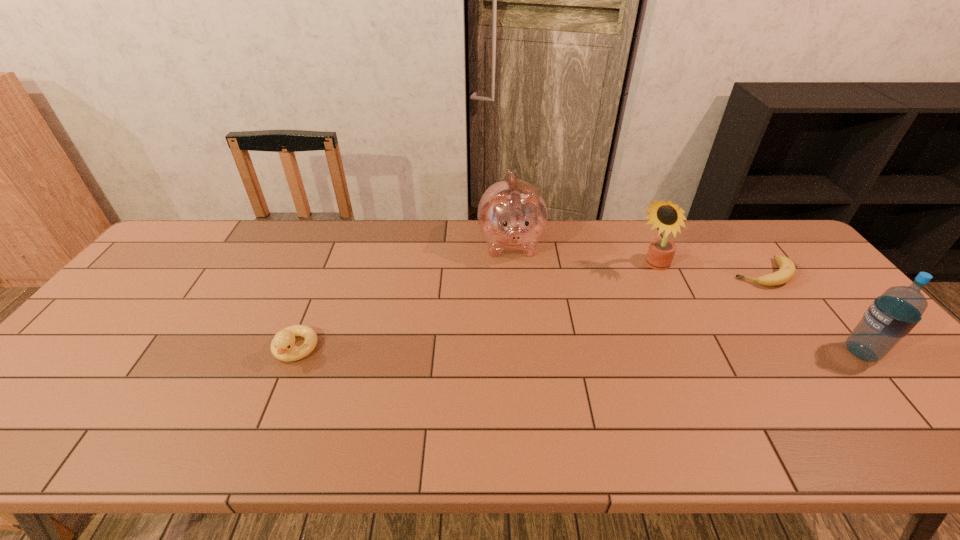
At what (x,y) coordinates should I click in order to perform the action: click on free space on the desktop that is between the duckling and the water bottle and is positioned on the face of the third object from right to left. Please return your answer as a coordinate pair (x, y). Looking at the image, I should click on (565, 350).

Where is `free space on the desktop that is between the leftmost object and the water bottle and is positioned at the stem of the banana`? The width and height of the screenshot is (960, 540). free space on the desktop that is between the leftmost object and the water bottle and is positioned at the stem of the banana is located at coordinates (634, 351).

The height and width of the screenshot is (540, 960). I want to click on free spot on the desktop that is between the fourth tallest object and the water bottle and is positioned on the front facing side of the fourth object from right to left, so click(525, 350).